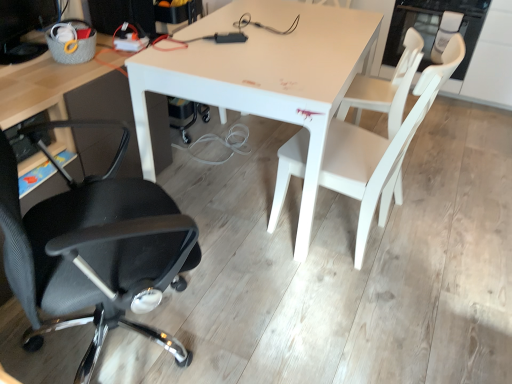
The width and height of the screenshot is (512, 384). Identify the location of vacant region to the right of black mesh office chair at left, which is counted as the 3th chair, starting from the right. (268, 310).